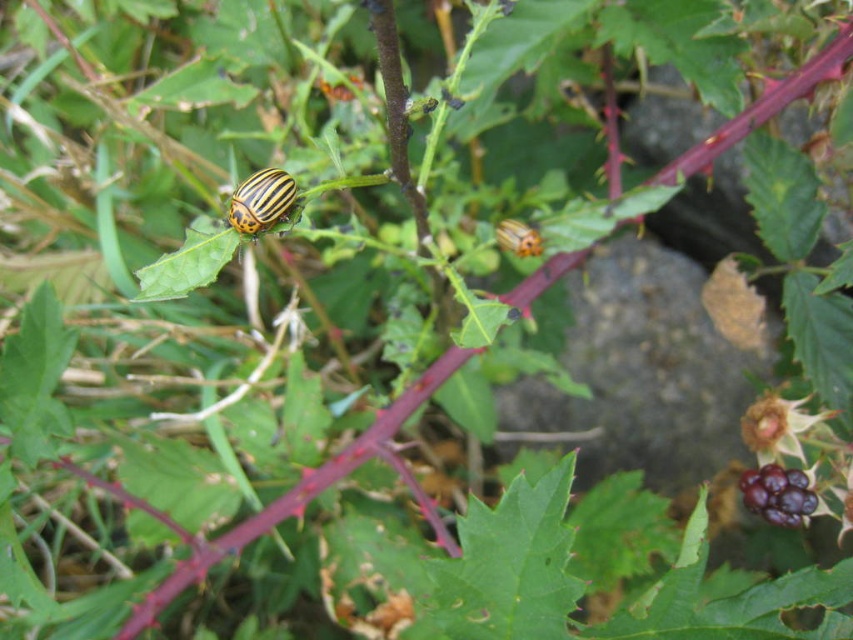
You are a gardener who wants to pick the shiny purple berry at lower right. Which direction should you move relative to the green matte leaf at center to reach it?

To reach the shiny purple berry at lower right, you should move to the right side of the green matte leaf at center since it is positioned on the left side of the shiny purple berry at lower right.

You are a gardener trying to inspect the yellow striped beetle at center on the green matte leaf at center. Can you reach the beetle without moving the leaf?

The green matte leaf at center is positioned under the yellow striped beetle at center, so the beetle is on top of the leaf. Since the leaf is directly beneath the beetle, you can reach the beetle without needing to move the leaf.